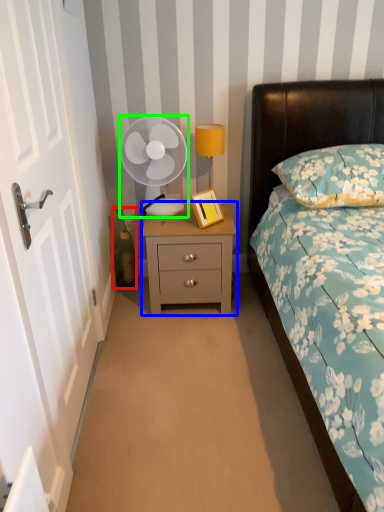
Question: Based on their relative distances, which object is farther from bottle (highlighted by a red box)? Choose from nightstand (highlighted by a blue box) and mechanical fan (highlighted by a green box).

Choices:
 (A) nightstand
 (B) mechanical fan

Answer: (A)